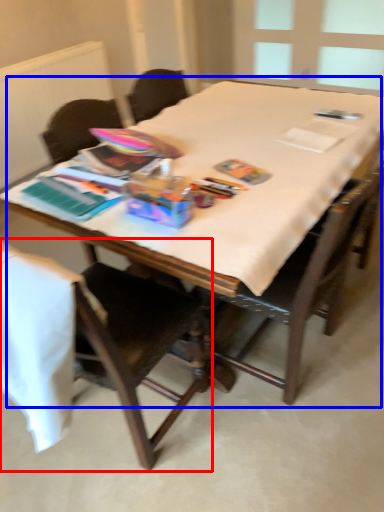
Question: Which object is closer to the camera taking this photo, chair (highlighted by a red box) or table (highlighted by a blue box)?

Choices:
 (A) chair
 (B) table

Answer: (A)